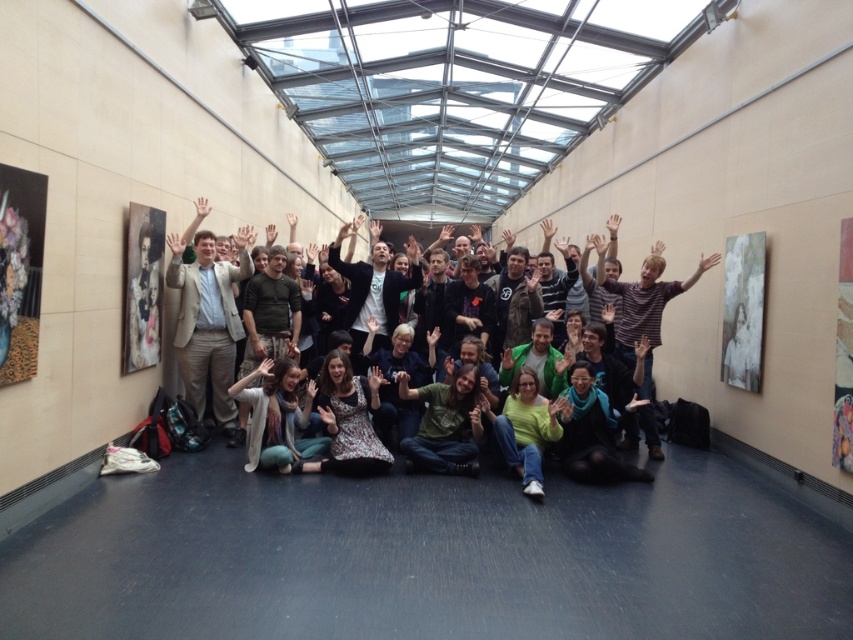
Based on the photo, is matte black jacket at center thinner than green jersey at center?

No, matte black jacket at center is not thinner than green jersey at center.

Is matte black jacket at center below green jersey at center?

No.

Measure the distance between point (325,266) and camera.

Point (325,266) is 7.72 meters from camera.

The height and width of the screenshot is (640, 853). I want to click on matte black jacket at center, so click(234, 285).